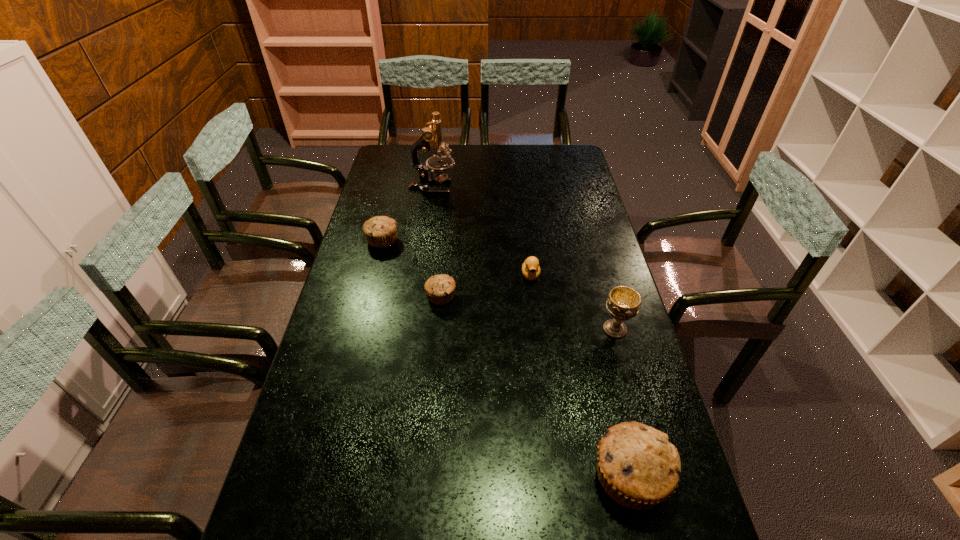
Find the location of a particular element. This screenshot has height=540, width=960. muffin located at the right edge is located at coordinates (638, 467).

The width and height of the screenshot is (960, 540). In order to click on chalice present at the right edge in this screenshot , I will do `click(623, 303)`.

At what (x,y) coordinates should I click in order to perform the action: click on object at the near right corner. Please return your answer as a coordinate pair (x, y). The image size is (960, 540). Looking at the image, I should click on point(638,467).

Identify the location of blank space at the far edge of the desktop. This screenshot has height=540, width=960. (511, 164).

In the image, there is a desktop. Where is `vacant space at the left edge`? Image resolution: width=960 pixels, height=540 pixels. vacant space at the left edge is located at coordinates (363, 326).

In order to click on free location at the right edge of the desktop in this screenshot , I will do `click(606, 310)`.

This screenshot has height=540, width=960. Identify the location of free space at the far left corner of the desktop. (385, 170).

You are a GUI agent. You are given a task and a screenshot of the screen. Output one action in this format:
    pyautogui.click(x=<x>, y=<y>)
    Task: Click on the free spot at the far right corner of the desktop
    This screenshot has height=540, width=960.
    Given the screenshot: What is the action you would take?
    pyautogui.click(x=555, y=168)

Identify the location of free space between the fifth farthest object and the third farthest object. (573, 302).

Image resolution: width=960 pixels, height=540 pixels. In order to click on unoccupied position between the chalice and the duckling in this screenshot , I will do `click(573, 302)`.